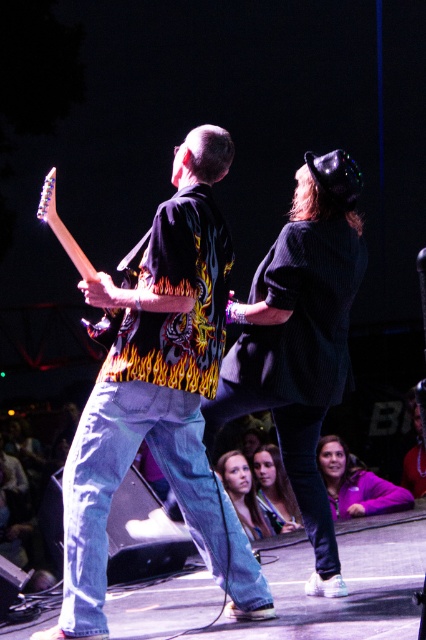
Question: Which point is closer to the camera taking this photo?

Choices:
 (A) (249, 612)
 (B) (350, 468)

Answer: (A)

Question: Can you confirm if flame-patterned shirt at center is bigger than smooth skin face at center?

Choices:
 (A) yes
 (B) no

Answer: (A)

Question: Which object appears farthest from the camera in this image?

Choices:
 (A) wooden electric guitar at left
 (B) flame-patterned shirt at center

Answer: (A)

Question: From the image, what is the correct spatial relationship of smooth brown hair at lower center in relation to smooth skin face at center?

Choices:
 (A) right
 (B) left

Answer: (A)

Question: Which point is closer to the camera?

Choices:
 (A) (218, 464)
 (B) (353, 476)
 (C) (267, 513)

Answer: (C)

Question: Is wooden electric guitar at left closer to the viewer compared to smooth brown hair at lower center?

Choices:
 (A) no
 (B) yes

Answer: (B)